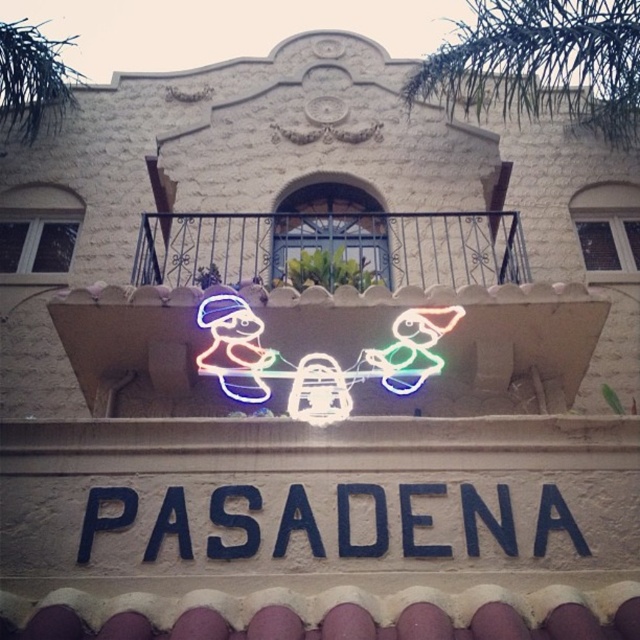
You are an event planner assessing the building facade for a new installation. The neon lights at center and the blue painted sign at center are both present. Which object has a greater width?

The neon lights at center have a greater width than the blue painted sign at center.